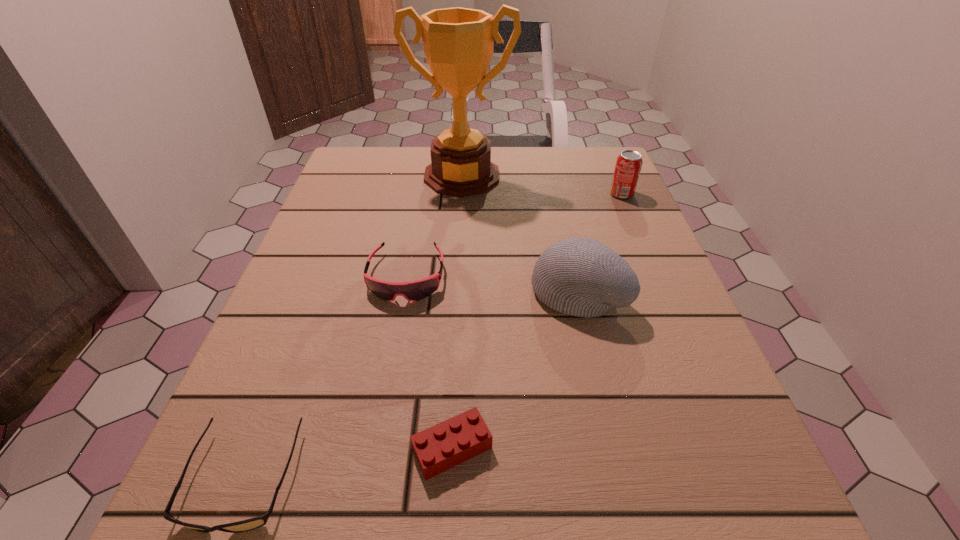
Identify the location of award present at the far edge. (458, 43).

You are a GUI agent. You are given a task and a screenshot of the screen. Output one action in this format:
    pyautogui.click(x=<x>, y=<y>)
    Task: Click on the soda can located in the far edge section of the desktop
    
    Given the screenshot: What is the action you would take?
    pyautogui.click(x=629, y=163)

Identify the location of object that is at the left edge. (416, 290).

You are a GUI agent. You are given a task and a screenshot of the screen. Output one action in this format:
    pyautogui.click(x=<x>, y=<y>)
    Task: Click on the beanie at the right edge
    The image size is (960, 540).
    Given the screenshot: What is the action you would take?
    pyautogui.click(x=582, y=277)

You are a GUI agent. You are given a task and a screenshot of the screen. Output one action in this format:
    pyautogui.click(x=<x>, y=<y>)
    Task: Click on the soda can that is at the right edge
    This screenshot has height=540, width=960.
    Given the screenshot: What is the action you would take?
    pyautogui.click(x=629, y=163)

This screenshot has height=540, width=960. In order to click on object at the far right corner in this screenshot , I will do `click(629, 163)`.

At what (x,y) coordinates should I click in order to perform the action: click on free space at the far edge. Please return your answer as a coordinate pair (x, y). Image resolution: width=960 pixels, height=540 pixels. Looking at the image, I should click on (516, 154).

You are a GUI agent. You are given a task and a screenshot of the screen. Output one action in this format:
    pyautogui.click(x=<x>, y=<y>)
    Task: Click on the free space at the left edge of the desktop
    
    Given the screenshot: What is the action you would take?
    pyautogui.click(x=391, y=195)

Where is `free space at the right edge of the desktop`? Image resolution: width=960 pixels, height=540 pixels. free space at the right edge of the desktop is located at coordinates (730, 418).

What are the coordinates of `free region at the far left corner` in the screenshot? It's located at (390, 167).